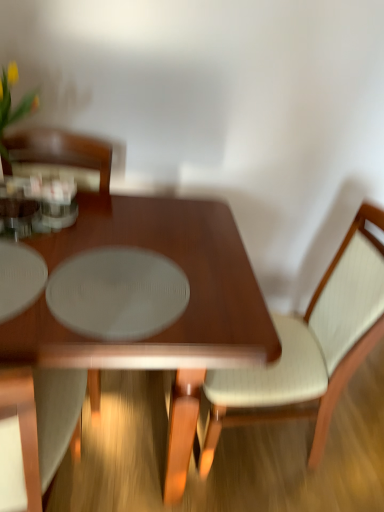
Locate an element on the screen. The image size is (384, 512). vacant space underneath light beige fabric chair at center, positioned as the first chair in right-to-left order (from a real-world perspective) is located at coordinates (256, 452).